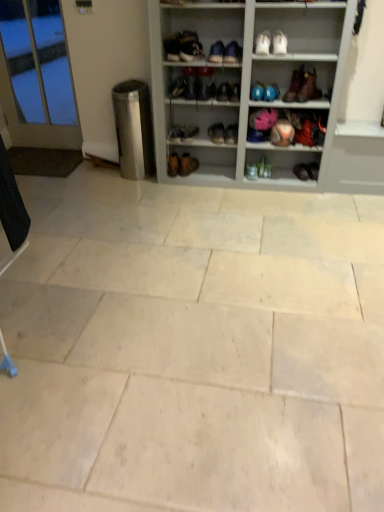
I want to click on free spot in front of matte blue shoe at center, which is the seventh footwear from right to left, so click(263, 182).